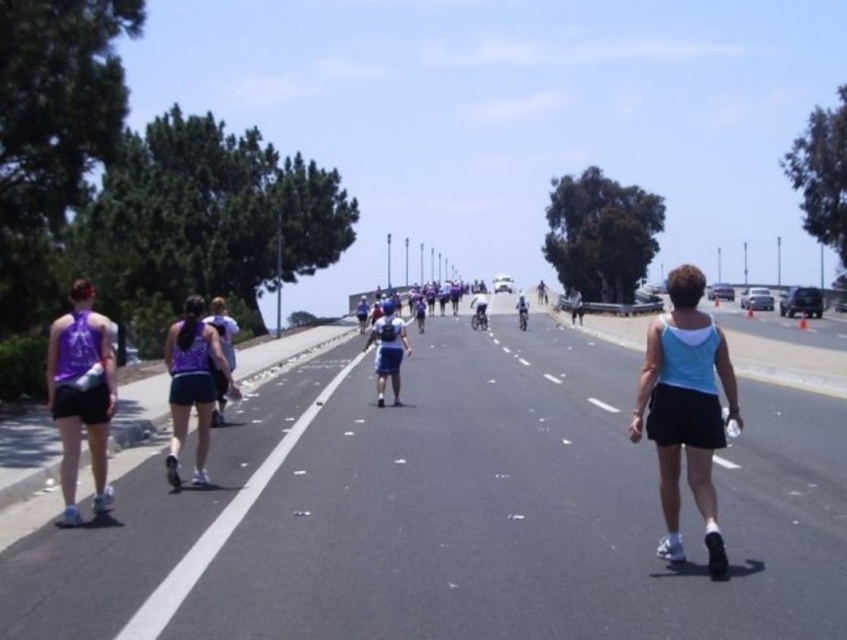
Question: Which is farther from the blue fabric tank top at center-right?

Choices:
 (A) purple fabric tank top at left
 (B) blue fabric skateboard at center
 (C) matte purple tank top at center-left

Answer: (A)

Question: Is blue fabric tank top at center-right thinner than shiny silver bicycle at center?

Choices:
 (A) no
 (B) yes

Answer: (A)

Question: Can you confirm if black asphalt road at center is thinner than shiny silver bicycle at center?

Choices:
 (A) no
 (B) yes

Answer: (A)

Question: Which point is closer to the camera?

Choices:
 (A) [483, 328]
 (B) [181, 374]
 (C) [67, 490]

Answer: (C)

Question: Which of the following is the farthest from the observer?

Choices:
 (A) matte purple tank top at center-left
 (B) blue fabric tank top at center-right

Answer: (A)

Question: Can you confirm if matte purple tank top at center-left is positioned to the left of shiny silver helmet at center?

Choices:
 (A) yes
 (B) no

Answer: (A)